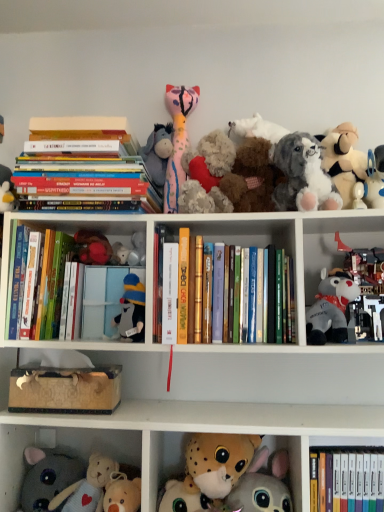
Question: Is the depth of fluffy gray dog at upper right, placed as the 3th toy when sorted from right to left, less than that of soft pink plush toy at upper center, arranged as the 4th toy when viewed from the left?

Choices:
 (A) yes
 (B) no

Answer: (A)

Question: From a real-world perspective, is fluffy gray dog at upper right, which is counted as the 7th toy, starting from the left, positioned over soft pink plush toy at upper center, placed as the sixth toy when sorted from right to left, based on gravity?

Choices:
 (A) yes
 (B) no

Answer: (B)

Question: From the image's perspective, is fluffy gray dog at upper right, placed as the 3th toy when sorted from right to left, above soft pink plush toy at upper center, arranged as the 4th toy when viewed from the left?

Choices:
 (A) no
 (B) yes

Answer: (A)

Question: Is fluffy gray dog at upper right, placed as the 3th toy when sorted from right to left, oriented away from soft pink plush toy at upper center, placed as the sixth toy when sorted from right to left?

Choices:
 (A) no
 (B) yes

Answer: (A)

Question: Does fluffy gray dog at upper right, which is counted as the 7th toy, starting from the left, have a larger size compared to soft pink plush toy at upper center, arranged as the 4th toy when viewed from the left?

Choices:
 (A) yes
 (B) no

Answer: (A)

Question: Would you consider fluffy gray dog at upper right, placed as the 3th toy when sorted from right to left, to be distant from soft pink plush toy at upper center, arranged as the 4th toy when viewed from the left?

Choices:
 (A) no
 (B) yes

Answer: (A)

Question: Is fluffy white stuffed animal at upper right, the 1th toy from the right, located outside hardcover book at center, the fourth book from the left?

Choices:
 (A) yes
 (B) no

Answer: (A)

Question: Is fluffy white stuffed animal at upper right, arranged as the ninth toy when viewed from the left, not near hardcover book at center, placed as the 4th book when sorted from top to bottom?

Choices:
 (A) yes
 (B) no

Answer: (B)

Question: Is fluffy white stuffed animal at upper right, the 1th toy from the right, taller than hardcover book at center, the first book positioned from the right?

Choices:
 (A) yes
 (B) no

Answer: (A)

Question: From a real-world perspective, does fluffy white stuffed animal at upper right, the 1th toy from the right, sit lower than hardcover book at center, which is the first book from bottom to top?

Choices:
 (A) yes
 (B) no

Answer: (B)

Question: From the image's perspective, is fluffy white stuffed animal at upper right, arranged as the ninth toy when viewed from the left, located above hardcover book at center, placed as the 4th book when sorted from top to bottom?

Choices:
 (A) yes
 (B) no

Answer: (A)

Question: Can you confirm if fluffy white stuffed animal at upper right, arranged as the ninth toy when viewed from the left, is thinner than hardcover book at center, placed as the 4th book when sorted from top to bottom?

Choices:
 (A) no
 (B) yes

Answer: (A)

Question: Considering the relative sizes of hardcover book at center, marked as the 2th paperback book in a right-to-left arrangement, and gray plush toy at right, which ranks as the 2th toy in right-to-left order, in the image provided, is hardcover book at center, marked as the 2th paperback book in a right-to-left arrangement, bigger than gray plush toy at right, which ranks as the 2th toy in right-to-left order,?

Choices:
 (A) yes
 (B) no

Answer: (B)